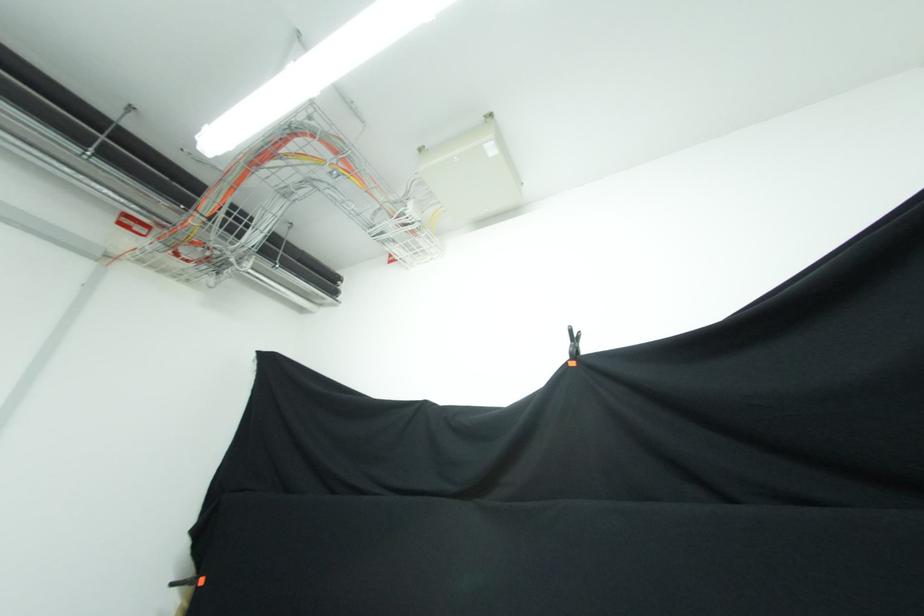
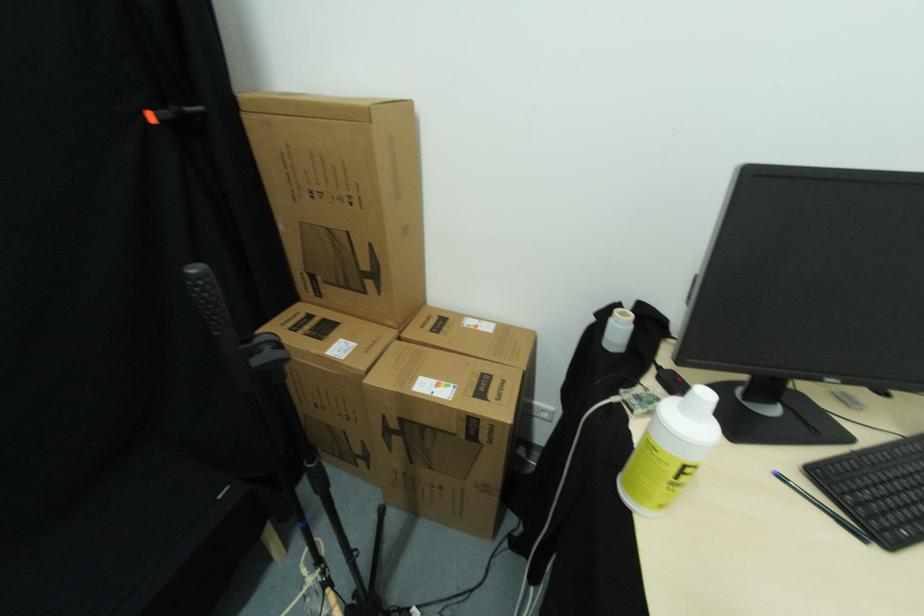
The images are taken continuously from a first-person perspective. In which direction is your viewpoint rotating?

The camera's rotation is toward right-down.